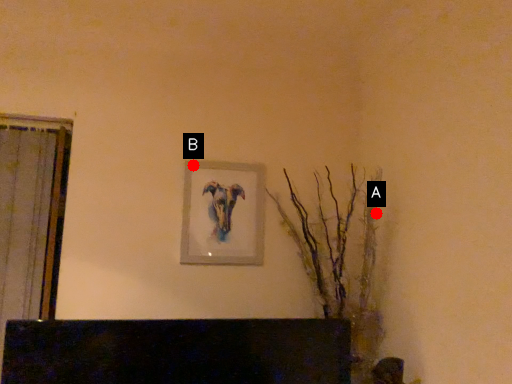
Question: Two points are circled on the image, labeled by A and B beside each circle. Among these points, which one is farthest from the camera?

Choices:
 (A) A is further
 (B) B is further

Answer: (B)